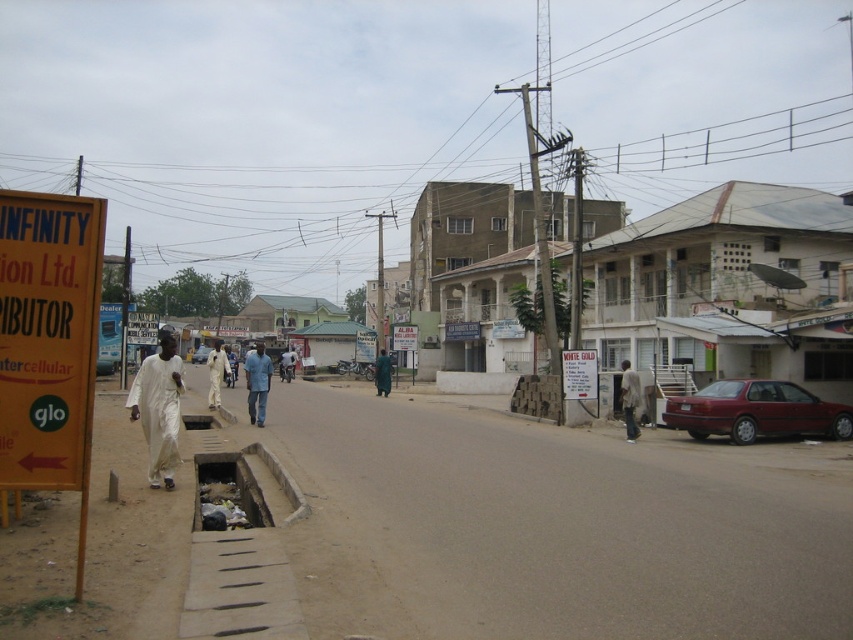
You are a delivery person who needs to deliver a package to the white cardboard sign at center. You are currently standing next to the white matte clothing at left. Can you walk straight to the sign without needing to move any obstacles?

The distance between the white matte clothing at left and the white cardboard sign at center is 10.08 meters. Since there are no mentioned obstacles in the scene description, you can walk straight to the sign.

You are a photographer standing at the camera position. You want to capture a closeup shot of the white matte clothing at left without moving closer than 30 feet. Can you achieve this?

The white matte clothing at left is 32.33 feet away from the camera. Since you cannot move closer than 30 feet, you cannot achieve the closeup shot as the minimum distance required is beyond your allowed proximity.